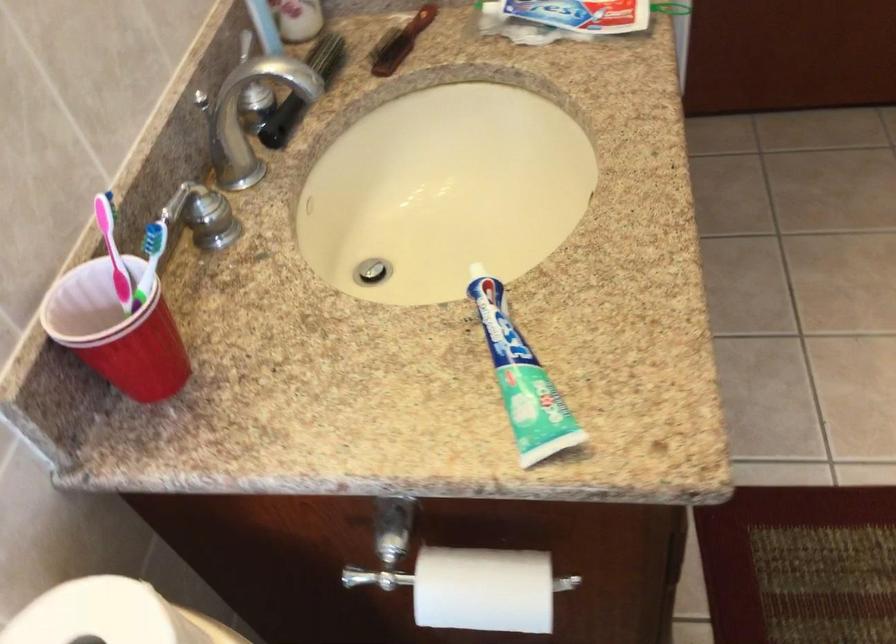
Where would you lift the pink toothbrush? Please return your answer as a coordinate pair (x, y).

(113, 251)